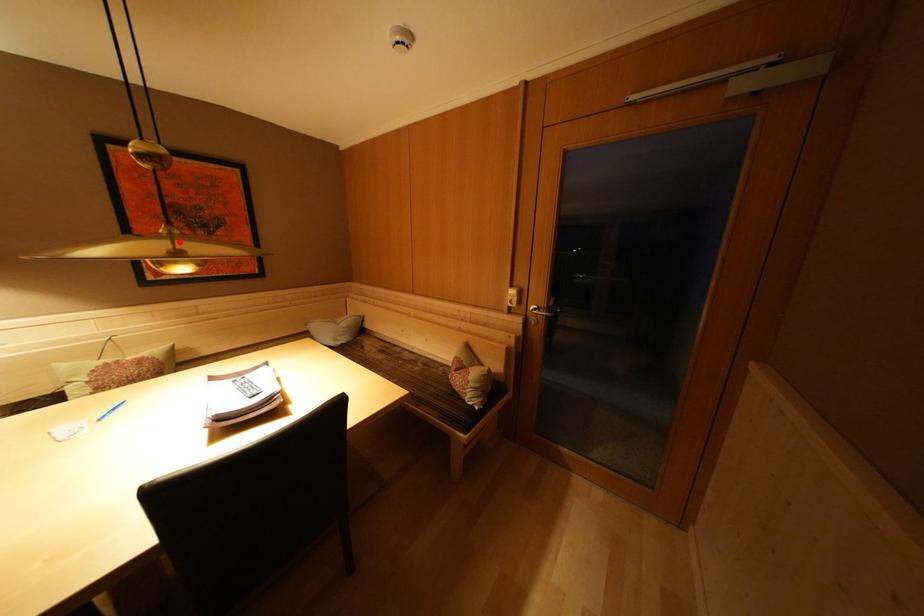
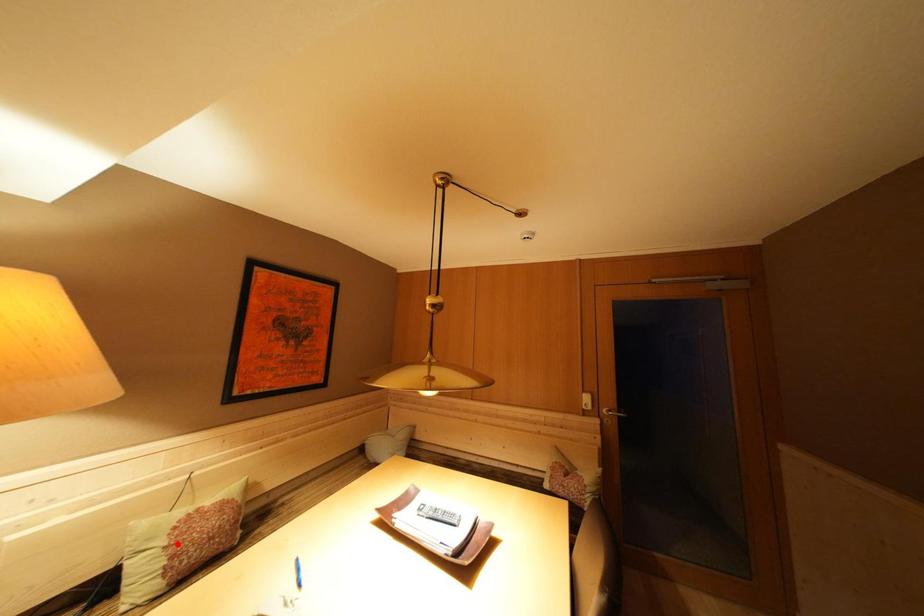
In the scene shown: I am providing you with two images of the same scene from different viewpoints. A red point is marked on the first image and another point is marked on the second image. Are the points marked in image1 and image2 representing the same 3D position?

No